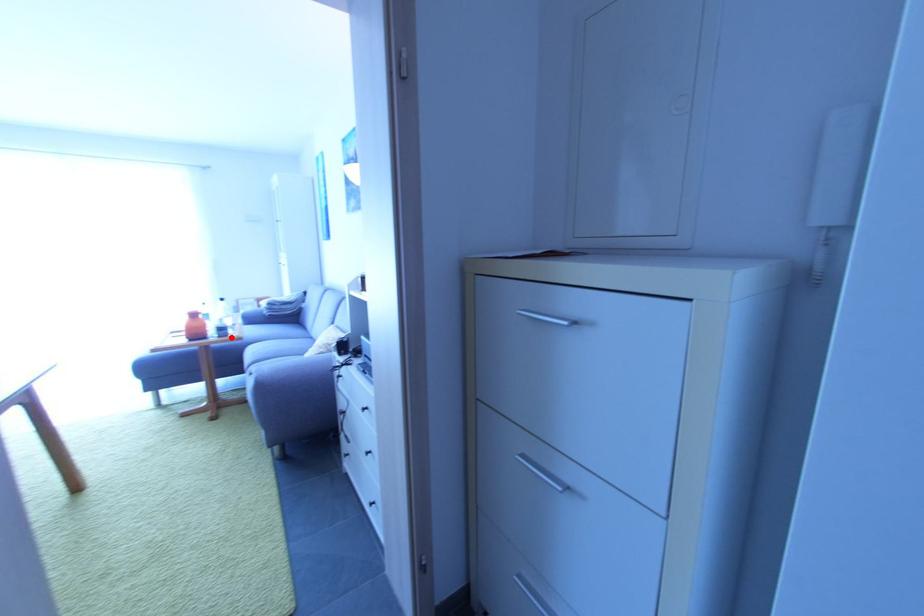
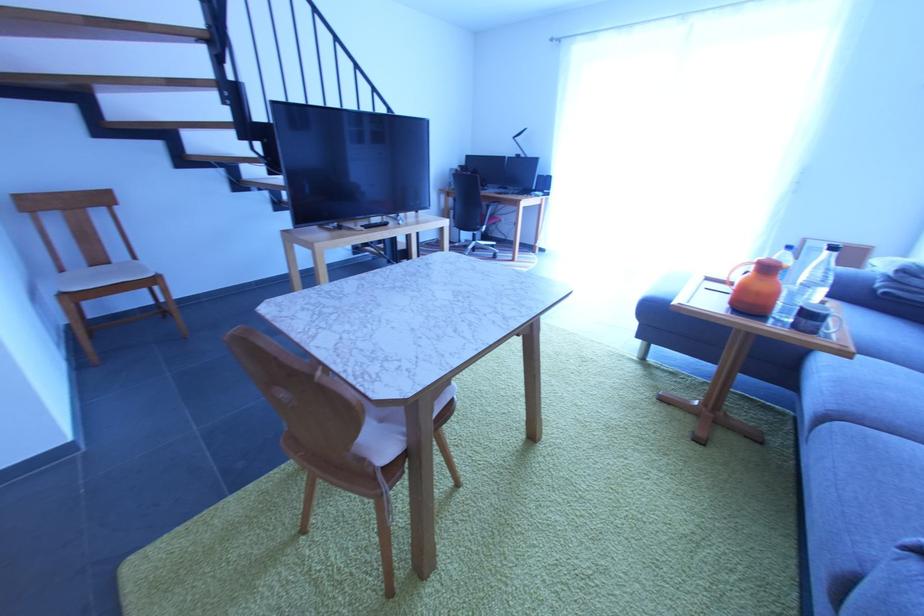
Question: I am providing you with two images of the same scene from different viewpoints. Image1 has a red point marked. In image2, the corresponding 3D location appears at what relative position? Reply with the corresponding letter.

Choices:
 (A) Closer
 (B) Farther

Answer: (B)